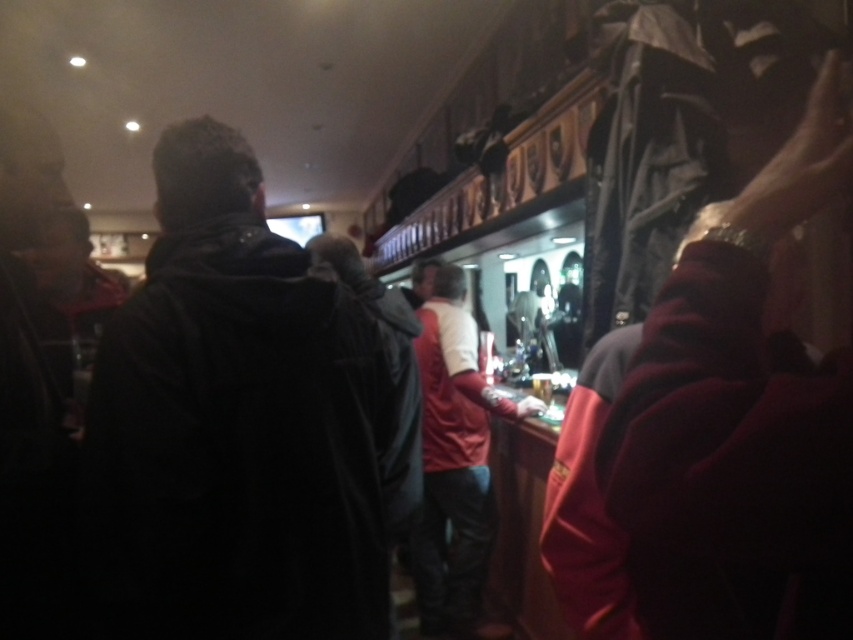
Which of these two, dark red sweater at right or red leather jacket at center, stands taller?

Standing taller between the two is red leather jacket at center.

This screenshot has height=640, width=853. What do you see at coordinates (740, 422) in the screenshot?
I see `dark red sweater at right` at bounding box center [740, 422].

Is point (756, 497) more distant than point (454, 348)?

No, it is in front of (454, 348).

This screenshot has width=853, height=640. Find the location of `dark red sweater at right`. dark red sweater at right is located at coordinates (740, 422).

Who is shorter, dark fabric jacket at center or dark red sweater at right?

With less height is dark red sweater at right.

Does dark fabric jacket at center have a lesser width compared to dark red sweater at right?

No.

Is point (259, 460) closer to camera compared to point (711, 552)?

No, (259, 460) is further to viewer.

What are the coordinates of `dark fabric jacket at center` in the screenshot? It's located at (235, 422).

Does dark fabric jacket at center appear on the right side of red leather jacket at center?

In fact, dark fabric jacket at center is to the left of red leather jacket at center.

Which of these two, dark fabric jacket at center or red leather jacket at center, stands taller?

red leather jacket at center is taller.

Is point (119, 628) positioned in front of point (428, 417)?

Yes, point (119, 628) is closer to viewer.

At what (x,y) coordinates should I click in order to perform the action: click on dark fabric jacket at center. Please return your answer as a coordinate pair (x, y). Looking at the image, I should click on (235, 422).